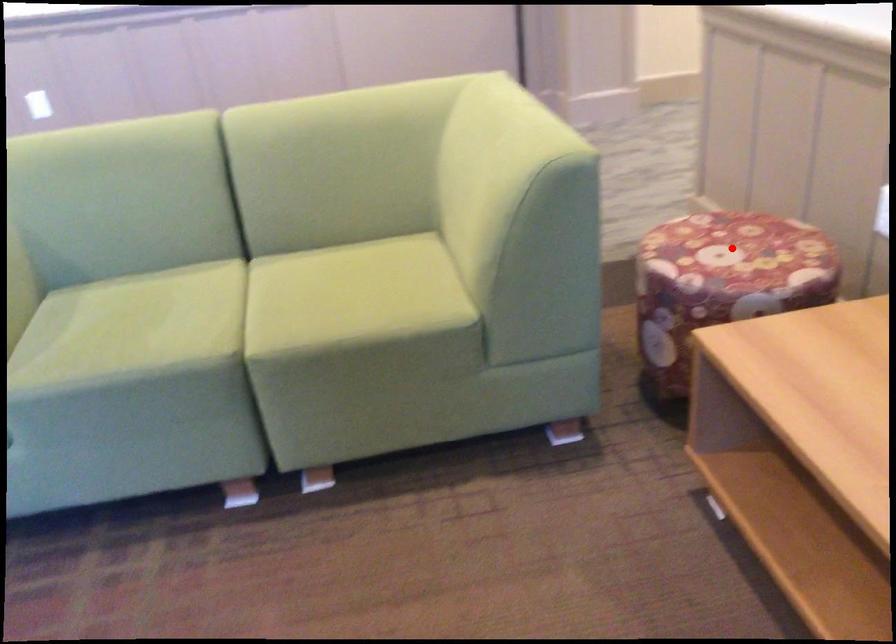
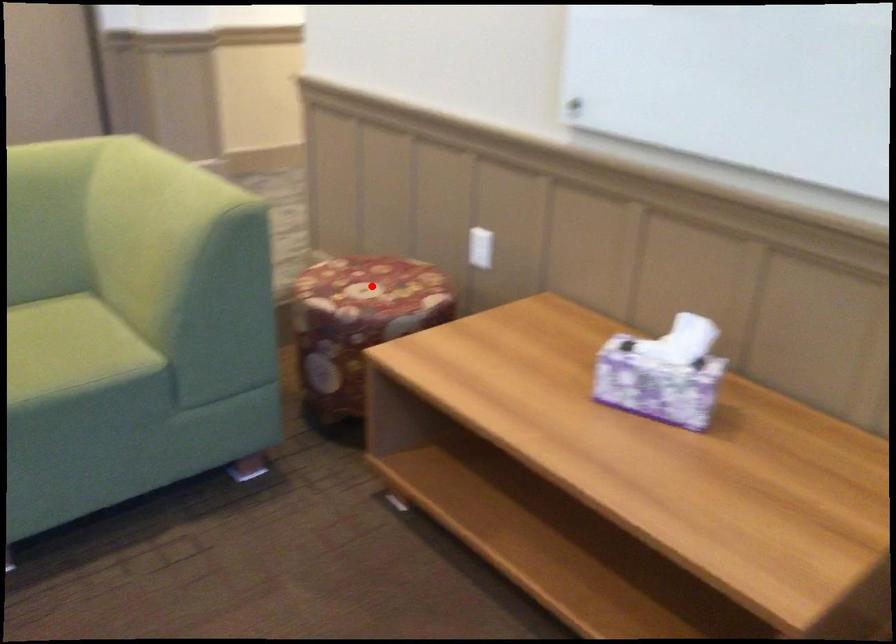
I am providing you with two images of the same scene from different viewpoints. A red point is marked on the first image and another point is marked on the second image. Do the highlighted points in image1 and image2 indicate the same real-world spot?

Yes